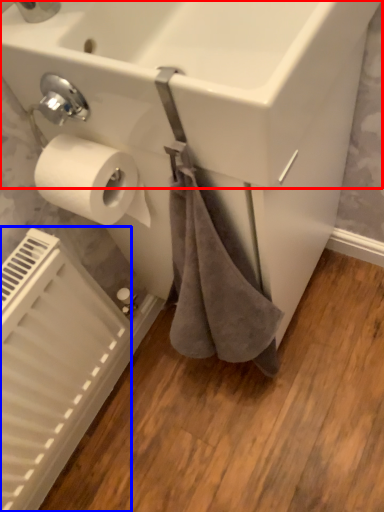
Question: Which point is closer to the camera, sink (highlighted by a red box) or radiator (highlighted by a blue box)?

Choices:
 (A) sink
 (B) radiator

Answer: (A)